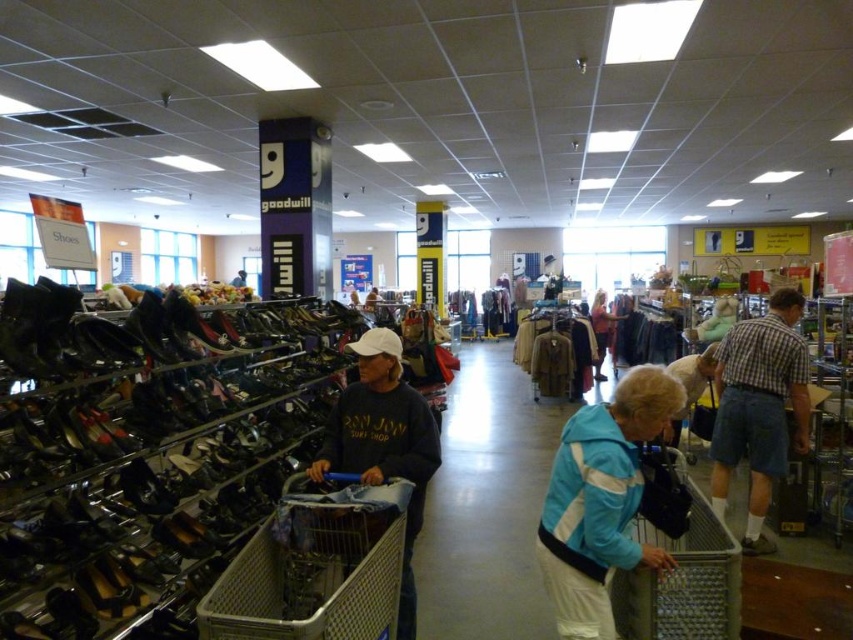
Does point (289, 566) come behind point (705, 570)?

Yes, point (289, 566) is behind point (705, 570).

Between silver metallic shopping cart at center and metallic silver shopping cart at lower center, which one has less height?

silver metallic shopping cart at center is shorter.

I want to click on silver metallic shopping cart at center, so click(315, 568).

You are a GUI agent. You are given a task and a screenshot of the screen. Output one action in this format:
    pyautogui.click(x=<x>, y=<y>)
    Task: Click on the silver metallic shopping cart at center
    The image size is (853, 640).
    Given the screenshot: What is the action you would take?
    pyautogui.click(x=315, y=568)

Does plaid shirt at right have a greater width compared to matte black jacket at center?

Incorrect, plaid shirt at right's width does not surpass matte black jacket at center's.

Describe the element at coordinates (759, 403) in the screenshot. This screenshot has height=640, width=853. I see `plaid shirt at right` at that location.

Find the location of a particular element. The height and width of the screenshot is (640, 853). plaid shirt at right is located at coordinates (759, 403).

Does blue fabric jacket at lower right appear over dark gray sweatshirt at center?

Yes.

Who is positioned more to the right, blue fabric jacket at lower right or dark gray sweatshirt at center?

Positioned to the right is blue fabric jacket at lower right.

Who is more forward, [608,426] or [370,464]?

Positioned in front is point [608,426].

I want to click on blue fabric jacket at lower right, so click(601, 499).